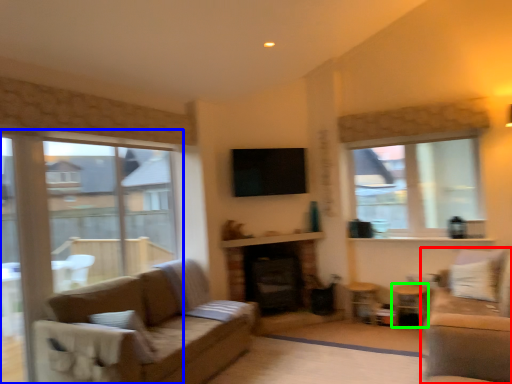
Question: Which object is positioned closest to studio couch (highlighted by a red box)? Select from window (highlighted by a blue box) and side table (highlighted by a green box).

Choices:
 (A) window
 (B) side table

Answer: (B)